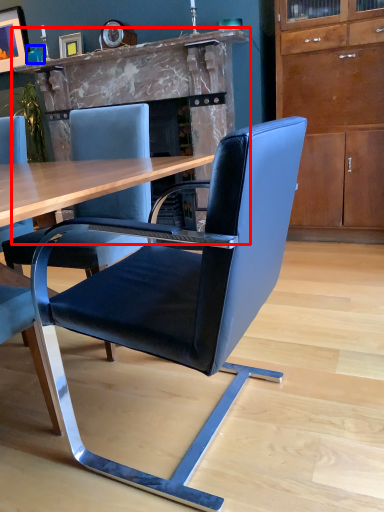
Question: Which point is further to the camera, fireplace (highlighted by a red box) or teal (highlighted by a blue box)?

Choices:
 (A) fireplace
 (B) teal

Answer: (B)